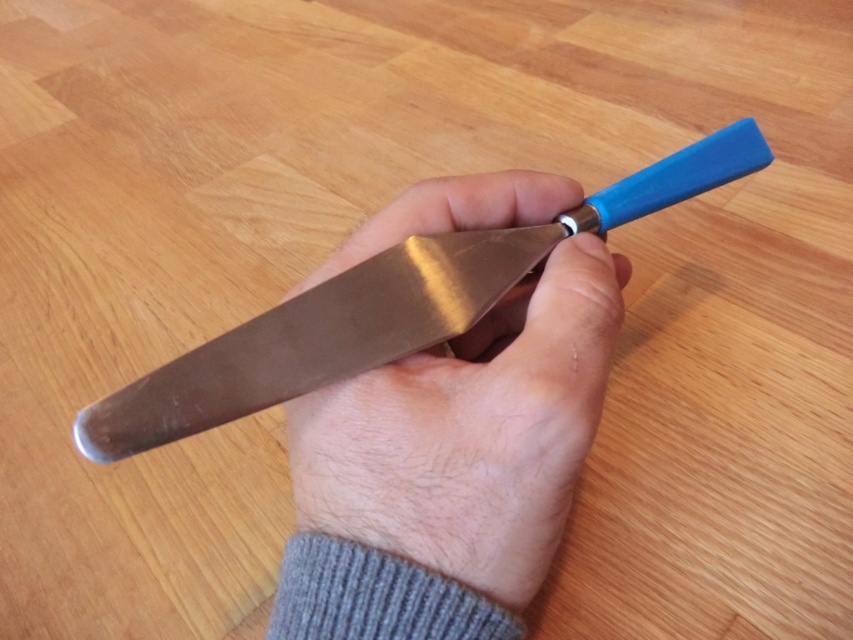
You are a chef preparing to cut vegetables. You have two knives on the wooden surface in front of you, the metallic knife at center and the polished metal knife at center. You need to place them side by side with at least 1.5 inches between their handles. Can you fit both knives on the 12 inch long cutting board?

The distance between the metallic knife at center and the polished metal knife at center is 1.26 inches, which is less than the required 1.5 inches. Therefore, you cannot place both knives side by side with the required spacing on the cutting board.

You are a chef preparing to cut vegetables. You have two knives on the wooden surface in front of you. One is the metallic knife at center and the other is the polished metal knife at center. Which knife is closer to you?

The metallic knife at center is positioned under the polished metal knife at center, so the polished metal knife at center is closer to you.